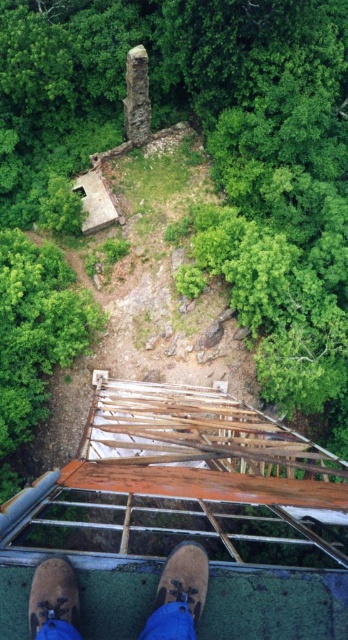
You are standing on the metal platform with the grid pattern and looking down. You see the brown leather shoes at center and the brown suede shoe at lower center. Which one is closer to your current position?

The brown leather shoes at center are closer to your current position because they are located above the brown suede shoe at lower center.

You are standing on the metal platform of the fire tower and notice two shoes below you. Which shoe is closer to you, the brown leather shoes at center or the brown suede shoe at lower left?

The brown leather shoes at center are closer to you because they are further to the viewer than the brown suede shoe at lower left.